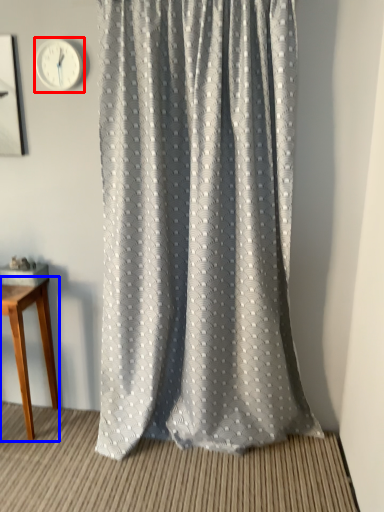
Question: Which object is closer to the camera taking this photo, clock (highlighted by a red box) or table (highlighted by a blue box)?

Choices:
 (A) clock
 (B) table

Answer: (A)